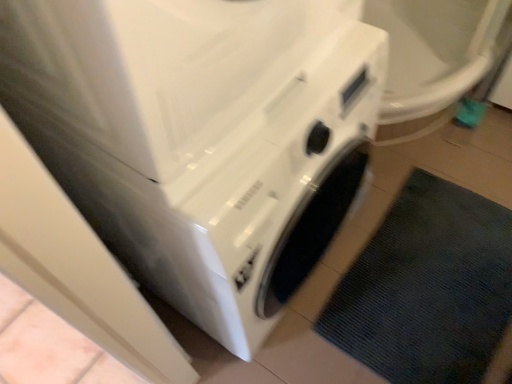
I want to click on vacant region below dark gray textured bath mat at lower right (from a real-world perspective), so click(426, 284).